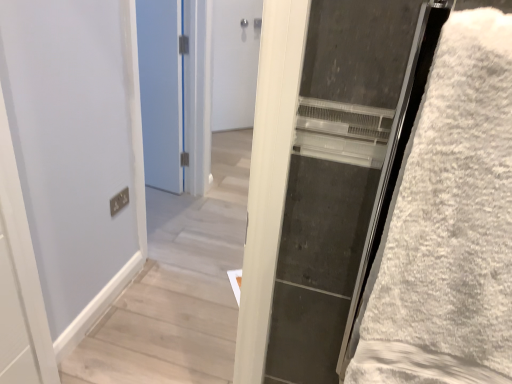
Question: From the image's perspective, is blue painted door at upper left, the second door from the right, located above or below white matte door at center, which appears as the second door when viewed from the left?

Choices:
 (A) above
 (B) below

Answer: (B)

Question: Is blue painted door at upper left, placed as the 2th door when sorted from back to front, in front of or behind white matte door at center, which appears as the second door when viewed from the left, in the image?

Choices:
 (A) front
 (B) behind

Answer: (A)

Question: Estimate the real-world distances between objects in this image. Which object is closer to the white matte door at center, acting as the 2th door starting from the front?

Choices:
 (A) white fluffy bath towel at right
 (B) blue painted door at upper left, the first door positioned from the front

Answer: (B)

Question: Which of these objects is positioned closest to the blue painted door at upper left, marked as the first door in a left-to-right arrangement?

Choices:
 (A) white fluffy bath towel at right
 (B) white matte door at center, which ranks as the first door in right-to-left order

Answer: (B)